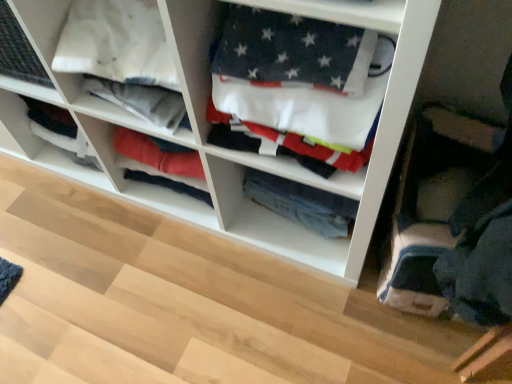
Question: In the image, is denim jeans at center, arranged as the 1th clothing when viewed from the back, on the left side or the right side of white cotton flag at center, which is the 2th clothing in back-to-front order?

Choices:
 (A) left
 (B) right

Answer: (B)

Question: Considering the positions of denim jeans at center, the second clothing in the front-to-back sequence, and white cotton flag at center, which is the 2th clothing in back-to-front order, in the image, is denim jeans at center, the second clothing in the front-to-back sequence, taller or shorter than white cotton flag at center, which is the 2th clothing in back-to-front order,?

Choices:
 (A) tall
 (B) short

Answer: (B)

Question: Considering the real-world distances, which object is farthest from the white fabric at center?

Choices:
 (A) white cotton flag at center, the 1th clothing in the front-to-back sequence
 (B) denim jeans at center, the second clothing in the front-to-back sequence

Answer: (B)

Question: Considering the real-world distances, which object is closest to the white fabric at center?

Choices:
 (A) denim jeans at center, arranged as the 1th clothing when viewed from the back
 (B) white cotton flag at center, the 1th clothing in the front-to-back sequence

Answer: (B)